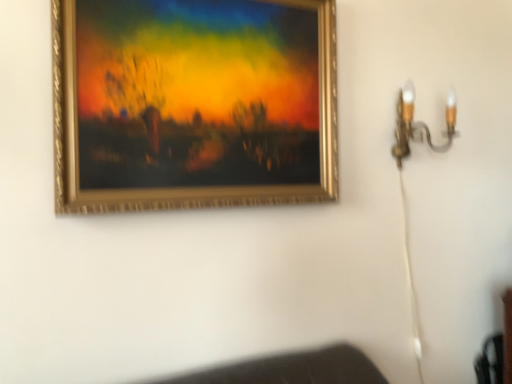
Image resolution: width=512 pixels, height=384 pixels. What do you see at coordinates (193, 104) in the screenshot?
I see `gold-framed painting at upper center` at bounding box center [193, 104].

Measure the distance between point (334,33) and camera.

They are 4.52 feet apart.

Locate an element on the screen. This screenshot has height=384, width=512. gold-framed painting at upper center is located at coordinates (193, 104).

Locate an element on the screen. gold metallic wall sconce at upper right is located at coordinates (419, 124).

This screenshot has height=384, width=512. What do you see at coordinates (419, 124) in the screenshot?
I see `gold metallic wall sconce at upper right` at bounding box center [419, 124].

This screenshot has height=384, width=512. I want to click on gold-framed painting at upper center, so 193,104.

Between gold metallic wall sconce at upper right and gold-framed painting at upper center, which one appears on the right side from the viewer's perspective?

Positioned to the right is gold metallic wall sconce at upper right.

In the image, is gold metallic wall sconce at upper right positioned in front of or behind gold-framed painting at upper center?

Visually, gold metallic wall sconce at upper right is located behind gold-framed painting at upper center.

Which point is more forward, (405, 127) or (162, 105)?

The point (162, 105) is more forward.

Consider the image. From the image's perspective, which is below, gold metallic wall sconce at upper right or gold-framed painting at upper center?

From the image's view, gold metallic wall sconce at upper right is below.

From a real-world perspective, is gold metallic wall sconce at upper right physically below gold-framed painting at upper center?

Yes, from a real-world perspective, gold metallic wall sconce at upper right is beneath gold-framed painting at upper center.

Between gold metallic wall sconce at upper right and gold-framed painting at upper center, which one has larger width?

gold metallic wall sconce at upper right.

Is gold metallic wall sconce at upper right shorter than gold-framed painting at upper center?

Yes, gold metallic wall sconce at upper right is shorter than gold-framed painting at upper center.

Is gold metallic wall sconce at upper right bigger or smaller than gold-framed painting at upper center?

Considering their sizes, gold metallic wall sconce at upper right takes up less space than gold-framed painting at upper center.

Choose the correct answer: Is gold metallic wall sconce at upper right inside gold-framed painting at upper center or outside it?

gold metallic wall sconce at upper right is located beyond the bounds of gold-framed painting at upper center.

Consider the image. Is gold metallic wall sconce at upper right far from gold-framed painting at upper center?

No, gold metallic wall sconce at upper right is not far away from gold-framed painting at upper center.

Is gold metallic wall sconce at upper right aimed at gold-framed painting at upper center?

No, gold metallic wall sconce at upper right is not facing towards gold-framed painting at upper center.

What's the angular difference between gold metallic wall sconce at upper right and gold-framed painting at upper center's facing directions?

gold metallic wall sconce at upper right and gold-framed painting at upper center are facing 0.435 degrees away from each other.

Find the location of a particular element. The height and width of the screenshot is (384, 512). lamp behind the gold-framed painting at upper center is located at coordinates (419, 124).

Considering the relative positions of gold-framed painting at upper center and gold metallic wall sconce at upper right in the image provided, is gold-framed painting at upper center to the left of gold metallic wall sconce at upper right from the viewer's perspective?

Correct, you'll find gold-framed painting at upper center to the left of gold metallic wall sconce at upper right.

Relative to gold metallic wall sconce at upper right, is gold-framed painting at upper center in front or behind?

gold-framed painting at upper center is in front of gold metallic wall sconce at upper right.

Is point (188, 15) closer or farther from the camera than point (407, 81)?

Point (188, 15) is closer to the camera than point (407, 81).

From the image's perspective, is gold-framed painting at upper center under gold metallic wall sconce at upper right?

No, from the image's perspective, gold-framed painting at upper center is not below gold metallic wall sconce at upper right.

From a real-world perspective, relative to gold metallic wall sconce at upper right, is gold-framed painting at upper center vertically above or below?

Clearly, from a real-world perspective, gold-framed painting at upper center is above gold metallic wall sconce at upper right.

Is gold-framed painting at upper center thinner than gold metallic wall sconce at upper right?

Correct, the width of gold-framed painting at upper center is less than that of gold metallic wall sconce at upper right.

From the picture: Does gold-framed painting at upper center have a lesser height compared to gold metallic wall sconce at upper right?

In fact, gold-framed painting at upper center may be taller than gold metallic wall sconce at upper right.

Can you confirm if gold-framed painting at upper center is bigger than gold metallic wall sconce at upper right?

Yes, gold-framed painting at upper center is bigger than gold metallic wall sconce at upper right.

Is gold metallic wall sconce at upper right inside gold-framed painting at upper center?

No.

In the scene shown: Would you consider gold-framed painting at upper center to be distant from gold metallic wall sconce at upper right?

No, there isn't a large distance between gold-framed painting at upper center and gold metallic wall sconce at upper right.

Does gold-framed painting at upper center turn towards gold metallic wall sconce at upper right?

No, gold-framed painting at upper center does not turn towards gold metallic wall sconce at upper right.

How different are the orientations of gold-framed painting at upper center and gold metallic wall sconce at upper right in degrees?

There is a 0.435-degree angle between the facing directions of gold-framed painting at upper center and gold metallic wall sconce at upper right.

I want to click on lamp located below the gold-framed painting at upper center (from the image's perspective), so click(419, 124).

Locate an element on the screen. The width and height of the screenshot is (512, 384). lamp lying on the right of gold-framed painting at upper center is located at coordinates (419, 124).

Identify the location of lamp located behind the gold-framed painting at upper center. (419, 124).